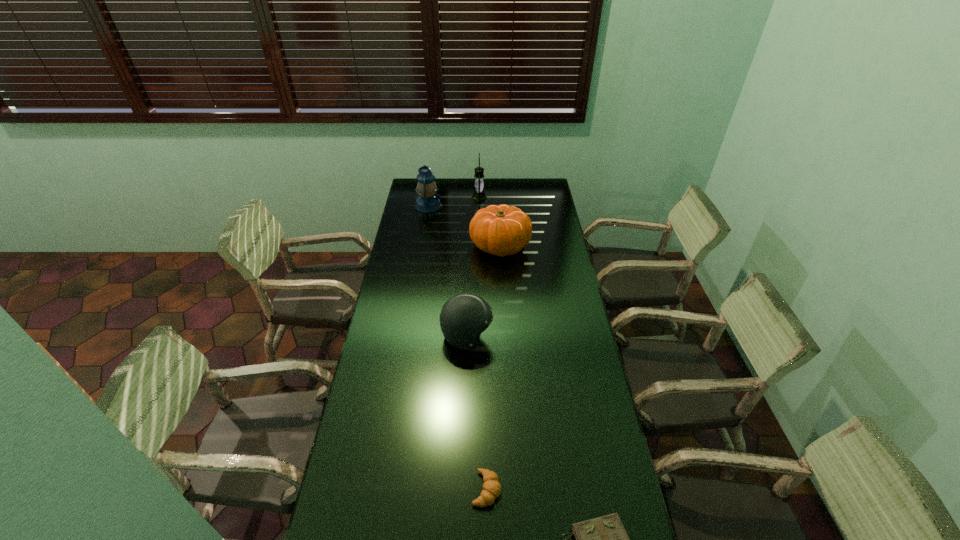
Locate an element on the screen. The width and height of the screenshot is (960, 540). empty space that is in between the right lantern and the left lantern is located at coordinates (454, 201).

Locate an element on the screen. The image size is (960, 540). the fifth closest object to the fourth farthest object is located at coordinates (478, 194).

At what (x,y) coordinates should I click in order to perform the action: click on object that is the second closest to the crescent roll. Please return your answer as a coordinate pair (x, y). Looking at the image, I should click on (463, 317).

What are the coordinates of `vacant space that satisfies the following two spatial constraints: 1. on the face of the left lantern; 2. on the left side of the fifth farthest object` in the screenshot? It's located at (382, 489).

The height and width of the screenshot is (540, 960). Find the location of `blank space that satisfies the following two spatial constraints: 1. on the back side of the pumpkin; 2. on the face of the left lantern`. blank space that satisfies the following two spatial constraints: 1. on the back side of the pumpkin; 2. on the face of the left lantern is located at coordinates (498, 206).

The image size is (960, 540). Find the location of `free space that satisfies the following two spatial constraints: 1. on the face of the left lantern; 2. on the right side of the crescent roll`. free space that satisfies the following two spatial constraints: 1. on the face of the left lantern; 2. on the right side of the crescent roll is located at coordinates (382, 489).

Find the location of a particular element. The height and width of the screenshot is (540, 960). blank space that satisfies the following two spatial constraints: 1. on the side where the crescent roll emits light; 2. on the right side of the right lantern is located at coordinates (478, 489).

Locate an element on the screen. The width and height of the screenshot is (960, 540). vacant space that satisfies the following two spatial constraints: 1. on the back side of the pumpkin; 2. on the side where the right lantern emits light is located at coordinates (x=497, y=197).

Image resolution: width=960 pixels, height=540 pixels. I want to click on vacant position in the image that satisfies the following two spatial constraints: 1. on the side where the right lantern emits light; 2. on the right side of the fourth nearest object, so click(479, 246).

Find the location of a particular element. The width and height of the screenshot is (960, 540). free space that satisfies the following two spatial constraints: 1. at the face opening of the fifth farthest object; 2. on the left side of the fourth farthest object is located at coordinates (463, 489).